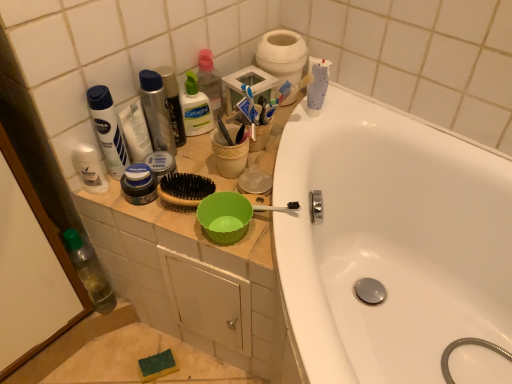
The height and width of the screenshot is (384, 512). Identify the location of white matte toothpaste at upper right, which is the 2th toothpaste in bottom-to-top order. (318, 86).

You are a GUI agent. You are given a task and a screenshot of the screen. Output one action in this format:
    pyautogui.click(x=<x>, y=<y>)
    Task: Click on the white matte tube at upper left, placed as the 2th toothpaste when sorted from top to bottom
    This screenshot has width=512, height=384.
    Given the screenshot: What is the action you would take?
    click(135, 131)

At what (x,y) coordinates should I click in order to perform the action: click on metallic silver mouthwash at upper center, which ranks as the first mouthwash in left-to-right order. Please return your answer as a coordinate pair (x, y). This screenshot has height=384, width=512. Looking at the image, I should click on (156, 111).

What is the approximate height of clear plastic bottle at upper center, which is the 1th toiletry in right-to-left order?

clear plastic bottle at upper center, which is the 1th toiletry in right-to-left order, is 7.01 inches tall.

Identify the location of clear plastic bottle at upper center, which ranks as the third toiletry in left-to-right order. The height and width of the screenshot is (384, 512). (210, 81).

Measure the distance between point (81, 148) and camera.

Point (81, 148) is 33.15 inches from camera.

What is the approximate width of white matte deodorant at upper left, which is counted as the 3th toiletry, starting from the right?

It is 1.95 inches.

Identify the location of white matte toilet paper at upper center. This screenshot has height=384, width=512. (282, 56).

Describe the element at coordinates (282, 56) in the screenshot. Image resolution: width=512 pixels, height=384 pixels. I see `white matte toilet paper at upper center` at that location.

The height and width of the screenshot is (384, 512). What do you see at coordinates (173, 103) in the screenshot?
I see `metallic silver mouthwash at center, the 2th mouthwash positioned from the left` at bounding box center [173, 103].

Locate an element on the screen. The width and height of the screenshot is (512, 384). white matte toothpaste at upper right, which is the 2th toothpaste in bottom-to-top order is located at coordinates (318, 86).

From a real-world perspective, between metallic silver mouthwash at upper center, which ranks as the first mouthwash in left-to-right order, and white matte toothpaste at upper right, which is the 2th toothpaste in bottom-to-top order, who is vertically lower?

From a 3D spatial view, metallic silver mouthwash at upper center, which ranks as the first mouthwash in left-to-right order, is below.

Is metallic silver mouthwash at upper center, which ranks as the first mouthwash in left-to-right order, behind white matte toothpaste at upper right, which ranks as the 1th toothpaste in top-to-bottom order?

No.

Does metallic silver mouthwash at upper center, which ranks as the first mouthwash in left-to-right order, turn towards white matte toothpaste at upper right, which is the 2th toothpaste in bottom-to-top order?

No, metallic silver mouthwash at upper center, which ranks as the first mouthwash in left-to-right order, is not turned towards white matte toothpaste at upper right, which is the 2th toothpaste in bottom-to-top order.

How far apart are metallic silver mouthwash at upper center, the 2th mouthwash from the right, and white matte toothpaste at upper right, the second toothpaste from the left?

metallic silver mouthwash at upper center, the 2th mouthwash from the right, is 13.93 inches from white matte toothpaste at upper right, the second toothpaste from the left.

Locate an element on the screen. This screenshot has height=384, width=512. cleaning product in front of the clear plastic bottle at upper center, which is the 1th toiletry in right-to-left order is located at coordinates (195, 108).

Between translucent plastic bottle at upper center and clear plastic bottle at upper center, which is the 1th toiletry in right-to-left order, which one has larger size?

translucent plastic bottle at upper center is bigger.

Considering the positions of objects translucent plastic bottle at upper center and clear plastic bottle at upper center, which ranks as the third toiletry in left-to-right order, in the image provided, who is behind, translucent plastic bottle at upper center or clear plastic bottle at upper center, which ranks as the third toiletry in left-to-right order,?

clear plastic bottle at upper center, which ranks as the third toiletry in left-to-right order, is further away from the camera.

From a real-world perspective, is translucent plastic bottle at upper center above or below clear plastic bottle at upper center, which ranks as the third toiletry in left-to-right order?

In terms of real-world spatial position, translucent plastic bottle at upper center is below clear plastic bottle at upper center, which ranks as the third toiletry in left-to-right order.

Considering the positions of point (94, 170) and point (192, 79), is point (94, 170) closer or farther from the camera than point (192, 79)?

Point (94, 170).

Does white matte deodorant at upper left, which is counted as the 3th toiletry, starting from the right, have a smaller size compared to translucent plastic bottle at upper center?

Correct, white matte deodorant at upper left, which is counted as the 3th toiletry, starting from the right, occupies less space than translucent plastic bottle at upper center.

From the image's perspective, between white matte deodorant at upper left, the 1th toiletry viewed from the left, and translucent plastic bottle at upper center, who is located below?

white matte deodorant at upper left, the 1th toiletry viewed from the left.

Between white matte deodorant at upper left, the 1th toiletry viewed from the left, and translucent plastic bottle at upper center, which one has more height?

Standing taller between the two is translucent plastic bottle at upper center.

Is point (100, 164) positioned after point (108, 122)?

Yes.

Is white matte deodorant at upper left, the 1th toiletry viewed from the left, not near white matte lotion at upper left, placed as the 2th toiletry when sorted from left to right?

They are positioned close to each other.

Consider the image. Is white matte deodorant at upper left, the 1th toiletry viewed from the left, positioned before white matte lotion at upper left, placed as the 2th toiletry when sorted from left to right?

→ No, white matte deodorant at upper left, the 1th toiletry viewed from the left, is further to the viewer.

From the image's perspective, is white matte deodorant at upper left, which is counted as the 3th toiletry, starting from the right, under metallic silver mouthwash at upper center, which ranks as the first mouthwash in left-to-right order?

Yes, from the image's perspective, white matte deodorant at upper left, which is counted as the 3th toiletry, starting from the right, is below metallic silver mouthwash at upper center, which ranks as the first mouthwash in left-to-right order.

Which is in front, point (75, 165) or point (158, 96)?

Point (75, 165)

Looking at this image, measure the distance between white matte deodorant at upper left, the 1th toiletry viewed from the left, and metallic silver mouthwash at upper center, which ranks as the first mouthwash in left-to-right order.

white matte deodorant at upper left, the 1th toiletry viewed from the left, and metallic silver mouthwash at upper center, which ranks as the first mouthwash in left-to-right order, are 6.13 inches apart from each other.

Considering the points (202, 58) and (105, 301), which point is in front, point (202, 58) or point (105, 301)?

Point (202, 58)

In terms of width, does clear plastic bottle at upper center, which ranks as the third toiletry in left-to-right order, look wider or thinner when compared to transparent plastic bottle at lower left?

clear plastic bottle at upper center, which ranks as the third toiletry in left-to-right order, is thinner than transparent plastic bottle at lower left.

Considering the positions of objects clear plastic bottle at upper center, which ranks as the third toiletry in left-to-right order, and transparent plastic bottle at lower left in the image provided, who is more to the right, clear plastic bottle at upper center, which ranks as the third toiletry in left-to-right order, or transparent plastic bottle at lower left?

From the viewer's perspective, clear plastic bottle at upper center, which ranks as the third toiletry in left-to-right order, appears more on the right side.

How far apart are clear plastic bottle at upper center, which is the 1th toiletry in right-to-left order, and transparent plastic bottle at lower left?

clear plastic bottle at upper center, which is the 1th toiletry in right-to-left order, and transparent plastic bottle at lower left are 19.84 inches apart.

Can you confirm if white matte deodorant at upper left, the 1th toiletry viewed from the left, is bigger than white matte tube at upper left, which appears as the 2th toothpaste when viewed from the right?

No, white matte deodorant at upper left, the 1th toiletry viewed from the left, is not bigger than white matte tube at upper left, which appears as the 2th toothpaste when viewed from the right.

From the image's perspective, between white matte deodorant at upper left, which is counted as the 3th toiletry, starting from the right, and white matte tube at upper left, which is counted as the first toothpaste, starting from the left, who is located below?

white matte deodorant at upper left, which is counted as the 3th toiletry, starting from the right, from the image's perspective.

Considering the sizes of objects white matte deodorant at upper left, which is counted as the 3th toiletry, starting from the right, and white matte tube at upper left, placed as the 2th toothpaste when sorted from top to bottom, in the image provided, who is shorter, white matte deodorant at upper left, which is counted as the 3th toiletry, starting from the right, or white matte tube at upper left, placed as the 2th toothpaste when sorted from top to bottom,?

Standing shorter between the two is white matte deodorant at upper left, which is counted as the 3th toiletry, starting from the right.

The height and width of the screenshot is (384, 512). In the image, there is a metallic silver mouthwash at upper center, which ranks as the first mouthwash in left-to-right order. Find the location of `toothpaste above it (from the image's perspective)`. toothpaste above it (from the image's perspective) is located at coordinates (318, 86).

This screenshot has height=384, width=512. What are the coordinates of `toiletry that is behind the translucent plastic bottle at upper center` in the screenshot? It's located at tap(210, 81).

Estimate the real-world distances between objects in this image. Which object is closer to white matte lotion at upper left, placed as the 2th toiletry when sorted from left to right, white matte toothpaste at upper right, which ranks as the 1th toothpaste in top-to-bottom order, or white matte toilet paper at upper center?

white matte toilet paper at upper center is positioned closer to the anchor white matte lotion at upper left, placed as the 2th toiletry when sorted from left to right.

Considering their positions, is white matte deodorant at upper left, the 1th toiletry viewed from the left, positioned closer to transparent plastic bottle at lower left than white matte toilet paper at upper center?

Among the two, white matte deodorant at upper left, the 1th toiletry viewed from the left, is located nearer to transparent plastic bottle at lower left.

Looking at the image, which one is located closer to metallic silver mouthwash at center, the 2th mouthwash positioned from the left, white matte tube at upper left, placed as the 2th toothpaste when sorted from top to bottom, or metallic silver mouthwash at upper center, the 2th mouthwash from the right?

metallic silver mouthwash at upper center, the 2th mouthwash from the right.

Estimate the real-world distances between objects in this image. Which object is further from translucent plastic bottle at upper center, metallic silver mouthwash at center, the 2th mouthwash positioned from the left, or white matte tube at upper left, which is counted as the first toothpaste, starting from the left?

Among the two, white matte tube at upper left, which is counted as the first toothpaste, starting from the left, is located further to translucent plastic bottle at upper center.

Based on their spatial positions, is transparent plastic bottle at lower left or clear plastic bottle at upper center, which is the 1th toiletry in right-to-left order, further from translucent plastic bottle at upper center?

Based on the image, transparent plastic bottle at lower left appears to be further to translucent plastic bottle at upper center.

Looking at this image, looking at the image, which one is located further to white matte tube at upper left, which is counted as the first toothpaste, starting from the bottom, white matte toilet paper at upper center or white matte toothpaste at upper right, the second toothpaste from the left?

white matte toothpaste at upper right, the second toothpaste from the left.

Looking at this image, based on their spatial positions, is white matte lotion at upper left, placed as the 2th toiletry when sorted from left to right, or white matte toilet paper at upper center further from white matte toothpaste at upper right, marked as the 1th toothpaste in a right-to-left arrangement?

white matte lotion at upper left, placed as the 2th toiletry when sorted from left to right, is further to white matte toothpaste at upper right, marked as the 1th toothpaste in a right-to-left arrangement.

Estimate the real-world distances between objects in this image. Which object is closer to metallic silver mouthwash at center, which ranks as the 1th mouthwash in right-to-left order, white matte lotion at upper left, which is the 2th toiletry in right-to-left order, or white matte toilet paper at upper center?

white matte lotion at upper left, which is the 2th toiletry in right-to-left order, is closer to metallic silver mouthwash at center, which ranks as the 1th mouthwash in right-to-left order.

Find the location of `toiletry situated between metallic silver mouthwash at upper center, the 2th mouthwash from the right, and white matte toilet paper at upper center from left to right`. toiletry situated between metallic silver mouthwash at upper center, the 2th mouthwash from the right, and white matte toilet paper at upper center from left to right is located at coordinates (210, 81).

I want to click on toothpaste between white matte lotion at upper left, placed as the 2th toiletry when sorted from left to right, and metallic silver mouthwash at upper center, which ranks as the first mouthwash in left-to-right order, from left to right, so (135, 131).

This screenshot has height=384, width=512. Find the location of `toilet paper between translucent plastic bottle at upper center and white matte toothpaste at upper right, which ranks as the 1th toothpaste in top-to-bottom order`. toilet paper between translucent plastic bottle at upper center and white matte toothpaste at upper right, which ranks as the 1th toothpaste in top-to-bottom order is located at coordinates (282, 56).

Locate an element on the screen. This screenshot has height=384, width=512. mouthwash between metallic silver mouthwash at upper center, the 2th mouthwash from the right, and white matte toilet paper at upper center is located at coordinates (173, 103).